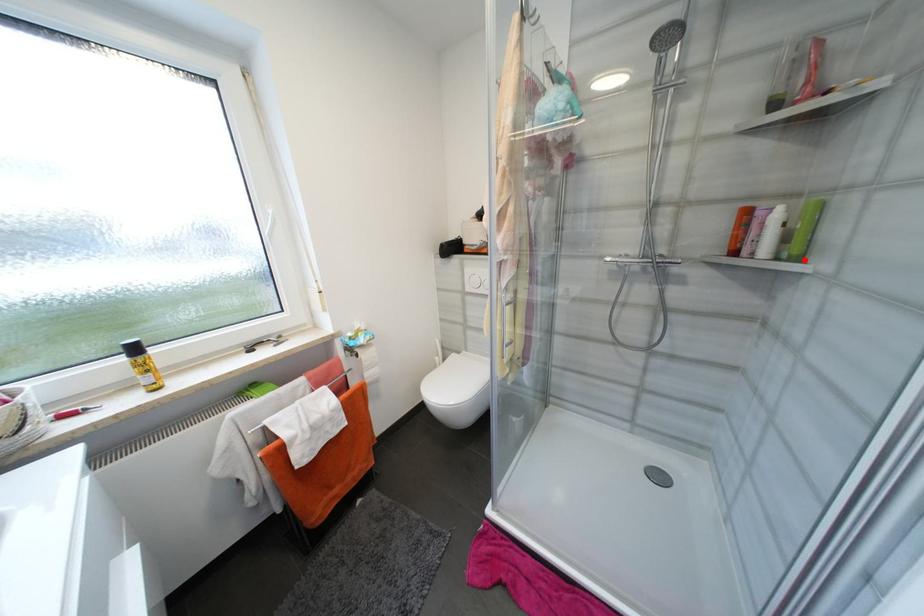
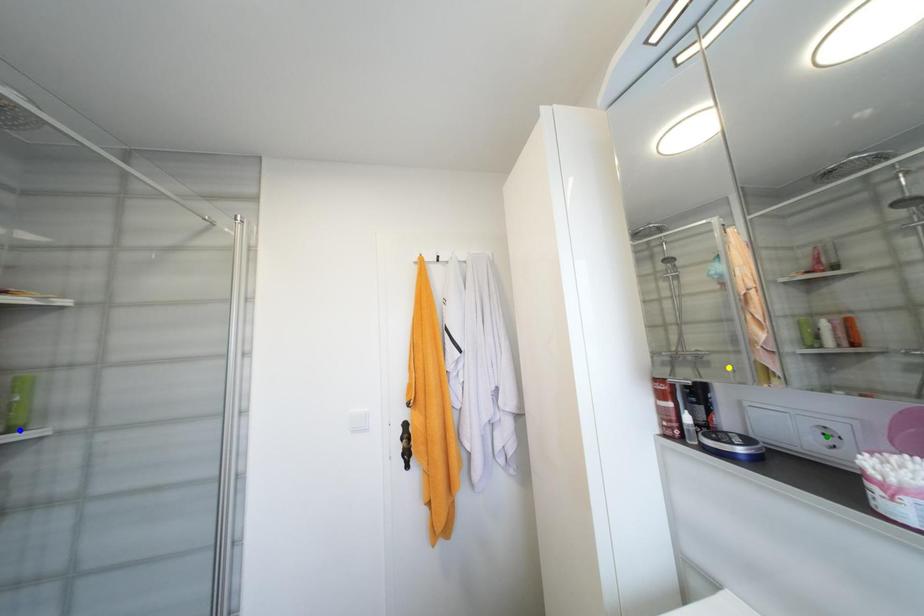
Question: I am providing you with two images of the same scene from different viewpoints. A red point is marked on the first image. You are given multiple points on the second image. Which mark in image 2 goes with the point in image 1?

Choices:
 (A) blue point
 (B) green point
 (C) yellow point

Answer: (A)